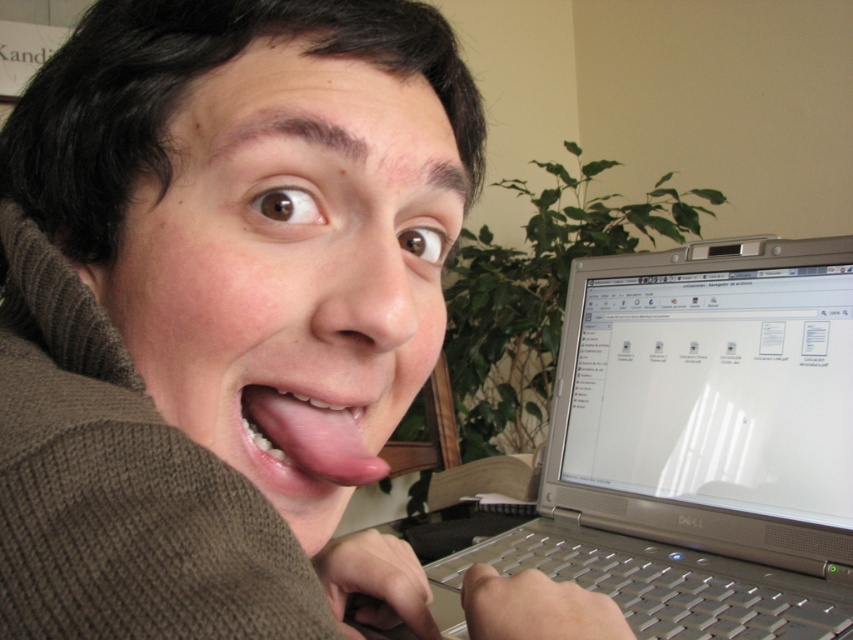
Question: Which point appears farthest from the camera in this image?

Choices:
 (A) pyautogui.click(x=772, y=500)
 (B) pyautogui.click(x=340, y=492)

Answer: (A)

Question: Can you confirm if matte silver laptop at center is positioned to the left of pink glossy tongue at center?

Choices:
 (A) yes
 (B) no

Answer: (A)

Question: Estimate the real-world distances between objects in this image. Which object is farther from the silver metallic laptop at upper right?

Choices:
 (A) pink glossy tongue at center
 (B) silver metallic laptop at right
 (C) matte silver laptop at center

Answer: (A)

Question: Does matte silver laptop at center appear under silver metallic laptop at right?

Choices:
 (A) yes
 (B) no

Answer: (B)

Question: Can you confirm if matte silver laptop at center is positioned to the right of pink glossy tongue at center?

Choices:
 (A) no
 (B) yes

Answer: (A)

Question: Which point is closer to the camera?

Choices:
 (A) (170, 598)
 (B) (273, 388)
 (C) (688, 634)
 (D) (827, 400)

Answer: (A)